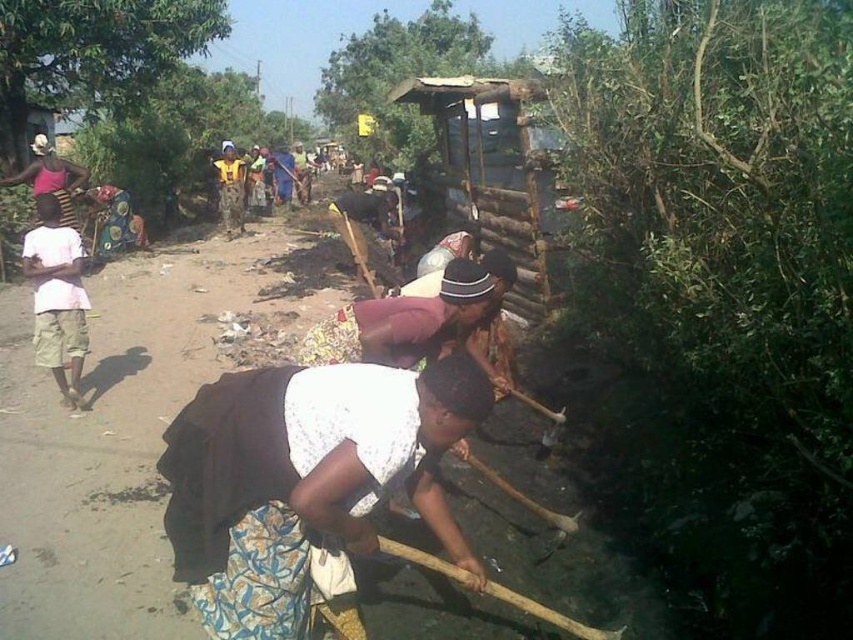
Question: Which object is farther from the camera taking this photo?

Choices:
 (A) white cotton shirt at left
 (B) green leafy tree at upper left

Answer: (B)

Question: Which of the following is the farthest from the observer?

Choices:
 (A) green leafy tree at upper center
 (B) green leafy tree at upper left

Answer: (A)

Question: Which point is closer to the camera taking this photo?

Choices:
 (A) (703, 234)
 (B) (138, 92)
 (C) (320, 104)
 (D) (71, 289)

Answer: (A)

Question: Can you confirm if green leafy tree at upper left is wider than white cotton shirt at left?

Choices:
 (A) yes
 (B) no

Answer: (A)

Question: From the image, what is the correct spatial relationship of green leafy tree at right in relation to green leafy tree at upper center?

Choices:
 (A) above
 (B) below

Answer: (B)

Question: Where is green leafy tree at upper left located in relation to white cotton shirt at left in the image?

Choices:
 (A) above
 (B) below

Answer: (A)